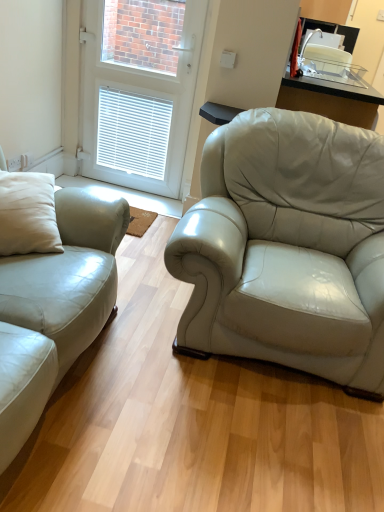
Question: Could you tell me if satin white leather couch at left is turned towards white glossy door at upper center?

Choices:
 (A) yes
 (B) no

Answer: (B)

Question: Considering the relative sizes of satin white leather couch at left and white glossy door at upper center in the image provided, is satin white leather couch at left smaller than white glossy door at upper center?

Choices:
 (A) no
 (B) yes

Answer: (A)

Question: Considering the relative sizes of satin white leather couch at left and white glossy door at upper center in the image provided, is satin white leather couch at left shorter than white glossy door at upper center?

Choices:
 (A) yes
 (B) no

Answer: (A)

Question: Is satin white leather couch at left to the left of white glossy door at upper center from the viewer's perspective?

Choices:
 (A) no
 (B) yes

Answer: (B)

Question: Is satin white leather couch at left to the right of white glossy door at upper center from the viewer's perspective?

Choices:
 (A) no
 (B) yes

Answer: (A)

Question: Is white glossy door at upper center a part of satin white leather couch at left?

Choices:
 (A) no
 (B) yes

Answer: (A)

Question: Can you confirm if white glossy door at upper center is positioned to the left of satin white leather couch at left?

Choices:
 (A) yes
 (B) no

Answer: (B)

Question: Is white glossy door at upper center smaller than satin white leather couch at left?

Choices:
 (A) no
 (B) yes

Answer: (B)

Question: Can we say white glossy door at upper center lies outside satin white leather couch at left?

Choices:
 (A) no
 (B) yes

Answer: (B)

Question: Can you confirm if white glossy door at upper center is taller than satin white leather couch at left?

Choices:
 (A) no
 (B) yes

Answer: (B)

Question: From a real-world perspective, does white glossy door at upper center stand above satin white leather couch at left?

Choices:
 (A) no
 (B) yes

Answer: (B)

Question: Does white glossy door at upper center lie behind satin white leather couch at left?

Choices:
 (A) no
 (B) yes

Answer: (B)

Question: Visually, is white glossy door at upper center positioned to the left or to the right of satin white leather couch at left?

Choices:
 (A) left
 (B) right

Answer: (B)